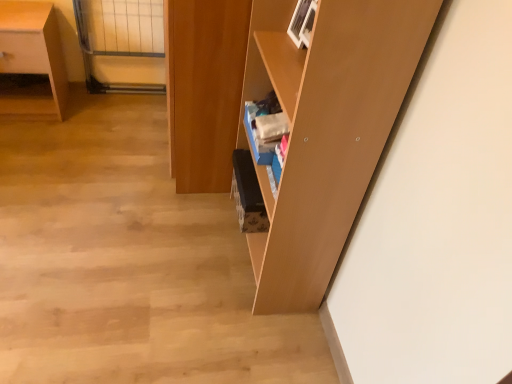
Question: From a real-world perspective, is wooden cabinet at center on matte wood desk at left?

Choices:
 (A) yes
 (B) no

Answer: (A)

Question: Is wooden cabinet at center further to the viewer compared to matte wood desk at left?

Choices:
 (A) no
 (B) yes

Answer: (A)

Question: Is matte wood desk at left at the back of wooden cabinet at center?

Choices:
 (A) no
 (B) yes

Answer: (A)

Question: Could you tell me if wooden cabinet at center is facing matte wood desk at left?

Choices:
 (A) no
 (B) yes

Answer: (B)

Question: Is wooden cabinet at center taller than matte wood desk at left?

Choices:
 (A) no
 (B) yes

Answer: (B)

Question: Considering the positions of clear glass door at upper left and matte wood shelf at center in the image, is clear glass door at upper left taller or shorter than matte wood shelf at center?

Choices:
 (A) tall
 (B) short

Answer: (B)

Question: In the image, is clear glass door at upper left positioned in front of or behind matte wood shelf at center?

Choices:
 (A) front
 (B) behind

Answer: (B)

Question: From the image's perspective, is clear glass door at upper left located above or below matte wood shelf at center?

Choices:
 (A) above
 (B) below

Answer: (A)

Question: Considering the relative positions of clear glass door at upper left and matte wood shelf at center in the image provided, is clear glass door at upper left to the left or to the right of matte wood shelf at center?

Choices:
 (A) right
 (B) left

Answer: (B)

Question: Is matte wood desk at left inside the boundaries of matte wood shelf at center, or outside?

Choices:
 (A) outside
 (B) inside

Answer: (A)

Question: Does point (31, 34) appear closer or farther from the camera than point (377, 61)?

Choices:
 (A) farther
 (B) closer

Answer: (A)

Question: Considering the positions of matte wood desk at left and matte wood shelf at center in the image, is matte wood desk at left taller or shorter than matte wood shelf at center?

Choices:
 (A) tall
 (B) short

Answer: (B)

Question: In the image, is matte wood desk at left positioned in front of or behind matte wood shelf at center?

Choices:
 (A) front
 (B) behind

Answer: (B)

Question: Is matte wood shelf at center to the left or to the right of matte wood desk at left in the image?

Choices:
 (A) left
 (B) right

Answer: (B)

Question: Considering the positions of matte wood shelf at center and matte wood desk at left in the image, is matte wood shelf at center wider or thinner than matte wood desk at left?

Choices:
 (A) wide
 (B) thin

Answer: (B)